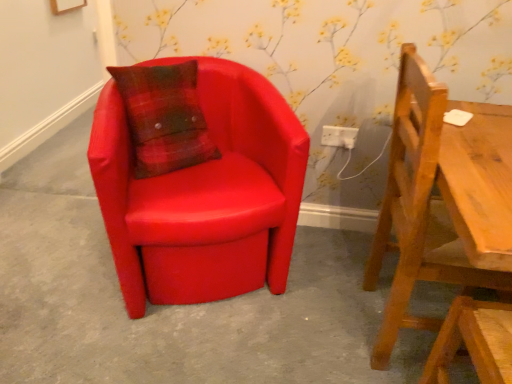
Where is `free space above matte red chair at center (from a real-world perspective)`? This screenshot has height=384, width=512. free space above matte red chair at center (from a real-world perspective) is located at coordinates (170, 312).